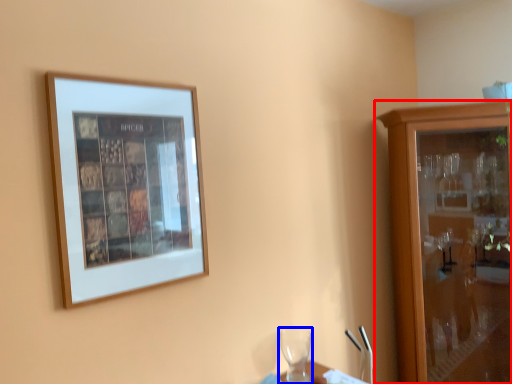
Question: Among these objects, which one is nearest to the camera, cabinetry (highlighted by a red box) or wine glass (highlighted by a blue box)?

Choices:
 (A) cabinetry
 (B) wine glass

Answer: (B)